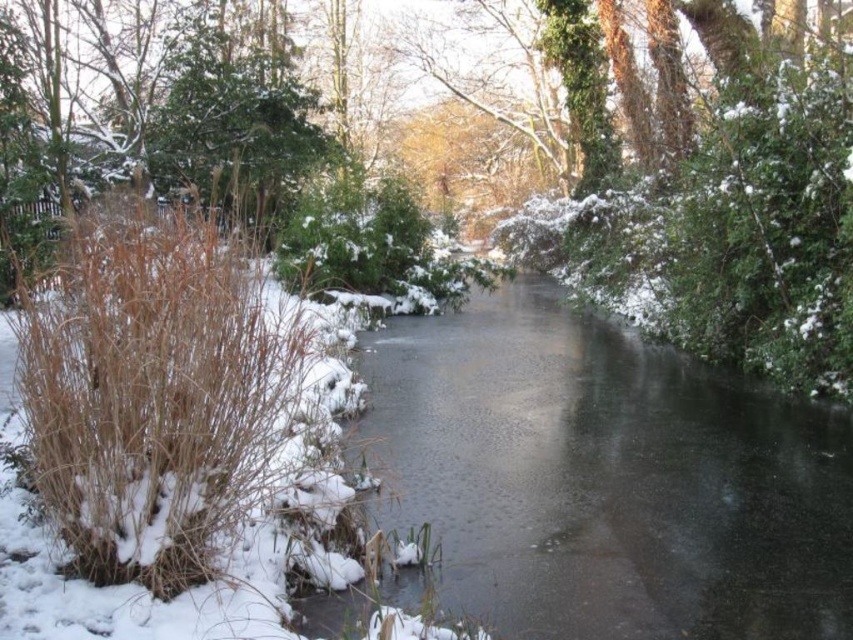
You are a small animal trying to cross the frozen ice at center to reach the safety of the brown dry reed at left. Given that the distance between them is 9.79 feet, can you make the jump if your maximum jump distance is 10 feet?

The distance between the frozen ice at center and the brown dry reed at left is 9.79 feet. Since your maximum jump distance is 10 feet, you can successfully jump from the frozen ice at center to the brown dry reed at left.

You are standing at the origin point of the image coordinate system, which is the bottom left corner. You want to reach the frozen ice at center. In which direction should you move first to get there?

Since the frozen ice at center is located at point [602,477], you should first move to the right and then move upward because the x coordinate is 0.748 and the y coordinate is 0.708. The coordinate system has the origin at the bottom left corner, so increasing x moves right and increasing y moves up.

You are an animal trying to cross the frozen ice at center to reach the other side of the river. However, there are brown dry reed at left nearby. Which direction should you move to avoid the reeds and stay on the ice?

The frozen ice at center is positioned under brown dry reed at left, so to avoid the reeds, you should move away from the brown dry reed at left and stay on the frozen ice at center.